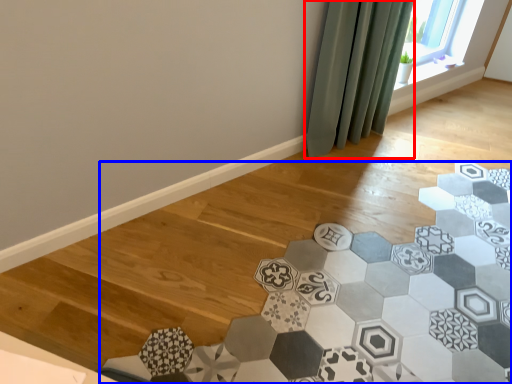
Question: Which object is closer to the camera taking this photo, curtain (highlighted by a red box) or ceramic tile (highlighted by a blue box)?

Choices:
 (A) curtain
 (B) ceramic tile

Answer: (B)